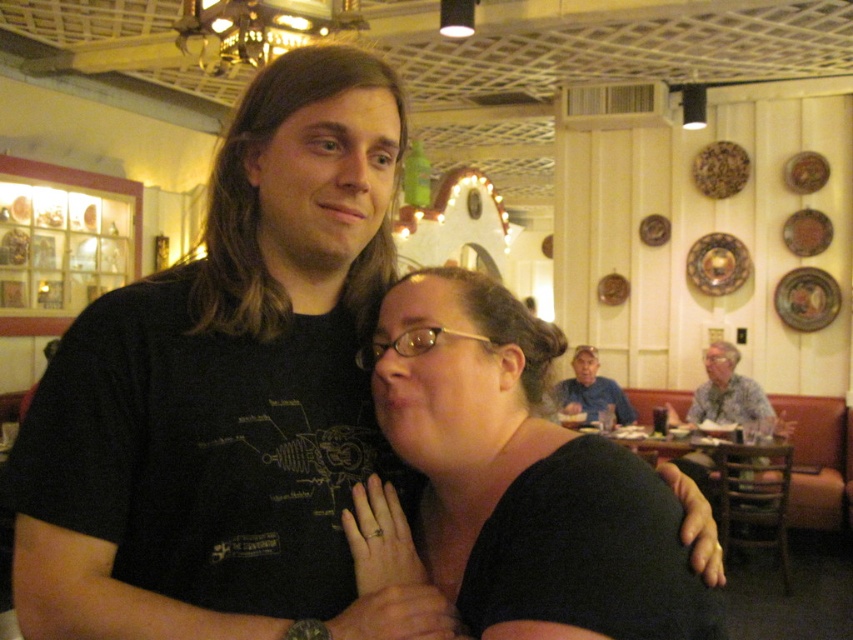
You are a customer in the restaurant and want to take a photo of the hawaiian print shirt at right. Where should you look to capture it in your camera?

You should look at point (730,396) to capture the hawaiian print shirt at right in your camera.

You are a photographer setting up for a group photo in the restaurant. You need to position the hawaiian print shirt at right and the blue denim shirt at upper center so that they are both visible in the frame. Based on their current positions, which shirt is positioned to the right side of the other?

The hawaiian print shirt at right is to the right of the blue denim shirt at upper center.